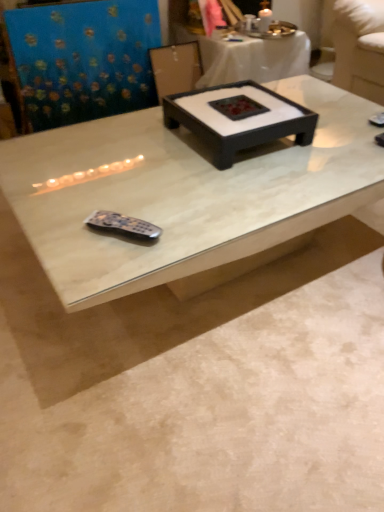
Question: In the image, is white marble coffee table at center, which is the 2th coffee table from right to left, positioned in front of or behind black matte tray at center, the first coffee table viewed from the right?

Choices:
 (A) behind
 (B) front

Answer: (B)

Question: Do you think white marble coffee table at center, which appears as the first coffee table when viewed from the left, is within black matte tray at center, which ranks as the 2th coffee table in left-to-right order, or outside of it?

Choices:
 (A) outside
 (B) inside

Answer: (A)

Question: Based on their positions, is white marble coffee table at center, which is the 2th coffee table from right to left, located to the left or right of black matte tray at center, the first coffee table viewed from the right?

Choices:
 (A) right
 (B) left

Answer: (B)

Question: In terms of size, does black matte tray at center, the first coffee table viewed from the right, appear bigger or smaller than white marble coffee table at center, which appears as the first coffee table when viewed from the left?

Choices:
 (A) big
 (B) small

Answer: (B)

Question: Does point (185, 96) appear closer or farther from the camera than point (354, 193)?

Choices:
 (A) closer
 (B) farther

Answer: (B)

Question: From a real-world perspective, is black matte tray at center, which ranks as the 2th coffee table in left-to-right order, above or below white marble coffee table at center, which appears as the first coffee table when viewed from the left?

Choices:
 (A) below
 (B) above

Answer: (B)

Question: Is black matte tray at center, the first coffee table viewed from the right, taller or shorter than white marble coffee table at center, which is the 2th coffee table from right to left?

Choices:
 (A) tall
 (B) short

Answer: (B)